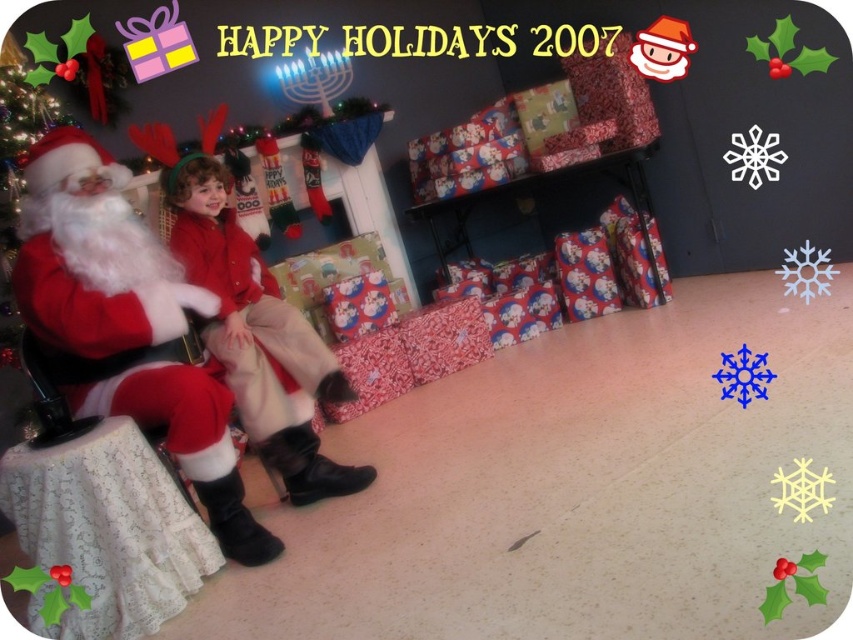
You are a photographer standing in the living room and want to take a photo of the red velvet santa at left and the red velvet coat at center. Which object should you focus on first if you want to capture both in sharp focus?

The red velvet santa at left is closer to the viewer than the red velvet coat at center. To capture both in sharp focus, you should focus on the red velvet coat at center since it is farther away, as depth of field typically extends more behind the point of focus than in front.

Based on the coordinates provided, where is the red velvet santa at left located in the image?

The red velvet santa at left is located at the coordinates point (125, 324).